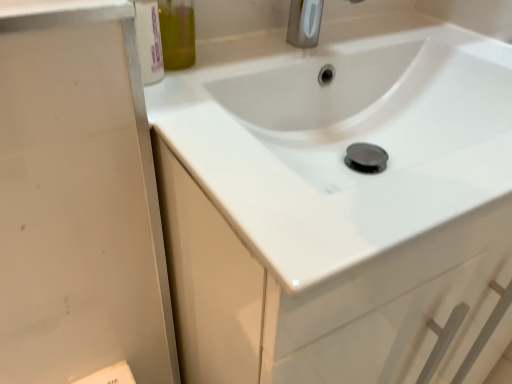
Question: Would you say satin nickel faucet at upper center is to the left or to the right of white glossy sink at center in the picture?

Choices:
 (A) right
 (B) left

Answer: (B)

Question: Is satin nickel faucet at upper center spatially inside white glossy sink at center, or outside of it?

Choices:
 (A) inside
 (B) outside

Answer: (B)

Question: Which object is the farthest from the white glossy sink at center?

Choices:
 (A) satin nickel faucet at upper center
 (B) olive green glass bottle at upper left

Answer: (B)

Question: Considering the real-world distances, which object is farthest from the white glossy sink at center?

Choices:
 (A) satin nickel faucet at upper center
 (B) olive green glass bottle at upper left

Answer: (B)